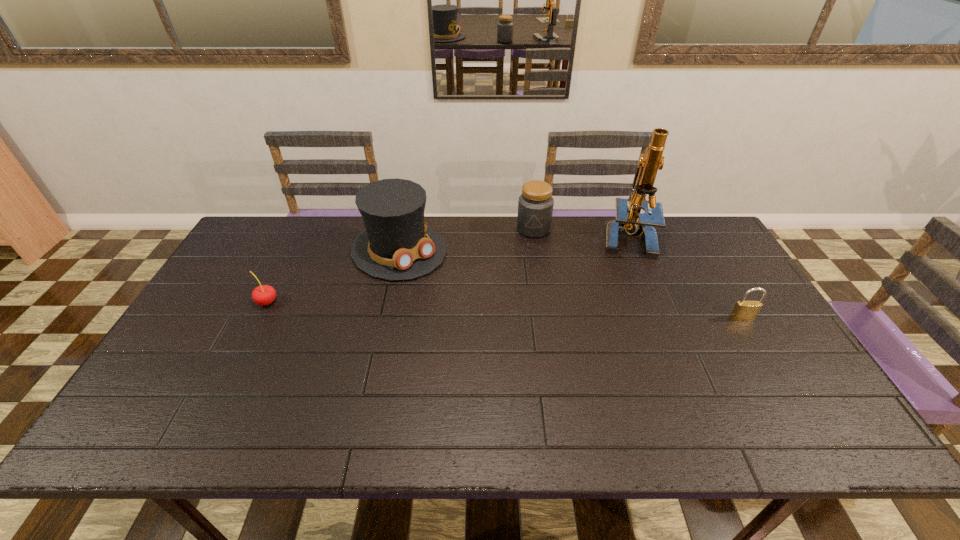
The image size is (960, 540). Identify the location of cherry. (262, 295).

Where is `the second nearest object`? The height and width of the screenshot is (540, 960). the second nearest object is located at coordinates (262, 295).

Locate an element on the screen. The width and height of the screenshot is (960, 540). the rightmost object is located at coordinates (743, 310).

Find the location of `the nearest object`. the nearest object is located at coordinates (743, 310).

Where is `jar`? This screenshot has width=960, height=540. jar is located at coordinates (535, 205).

The width and height of the screenshot is (960, 540). I want to click on the third shortest object, so click(535, 205).

The width and height of the screenshot is (960, 540). I want to click on the second tallest object, so click(397, 244).

This screenshot has width=960, height=540. Find the location of `dress hat`. dress hat is located at coordinates (397, 244).

The width and height of the screenshot is (960, 540). Find the location of `microscope`. microscope is located at coordinates (629, 220).

At what (x,y) coordinates should I click in order to perform the action: click on the tallest object. Please return your answer as a coordinate pair (x, y). This screenshot has width=960, height=540. Looking at the image, I should click on (629, 220).